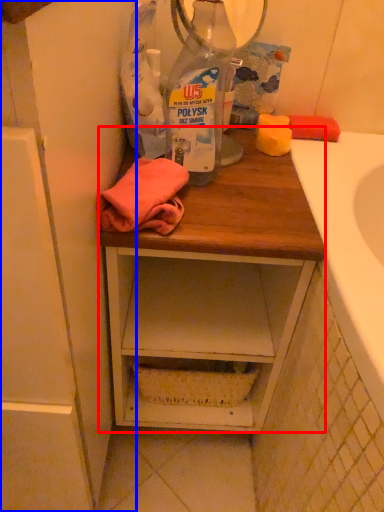
Question: Which of the following is the farthest to the observer, desk (highlighted by a red box) or cabinetry (highlighted by a blue box)?

Choices:
 (A) desk
 (B) cabinetry

Answer: (A)